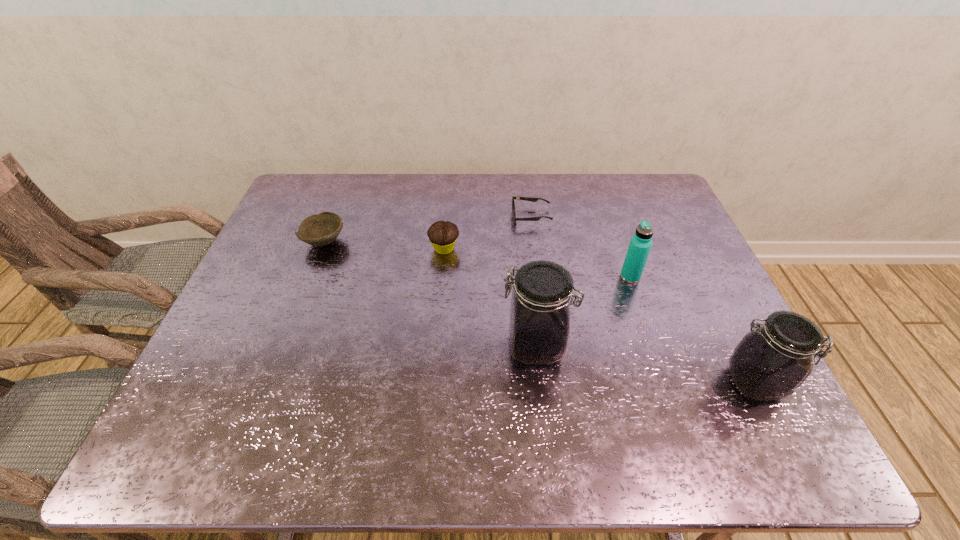
Where is `the tallest object`? the tallest object is located at coordinates pos(539,326).

You are a GUI agent. You are given a task and a screenshot of the screen. Output one action in this format:
    pyautogui.click(x=<x>, y=<y>)
    Task: Click on the left jar
    
    Given the screenshot: What is the action you would take?
    pyautogui.click(x=539, y=326)

Locate an element on the screen. This screenshot has height=540, width=960. the right jar is located at coordinates (771, 362).

Image resolution: width=960 pixels, height=540 pixels. Find the location of `the shorter jar`. the shorter jar is located at coordinates (771, 362).

Where is `the fifth object from left to right`? the fifth object from left to right is located at coordinates (640, 245).

This screenshot has width=960, height=540. I want to click on the fourth farthest object, so click(x=640, y=245).

This screenshot has width=960, height=540. I want to click on the farthest object, so click(x=531, y=199).

I want to click on sunglasses, so click(x=531, y=199).

I want to click on the second shortest object, so click(320, 229).

This screenshot has height=540, width=960. In order to click on the leftmost object in this screenshot , I will do `click(320, 229)`.